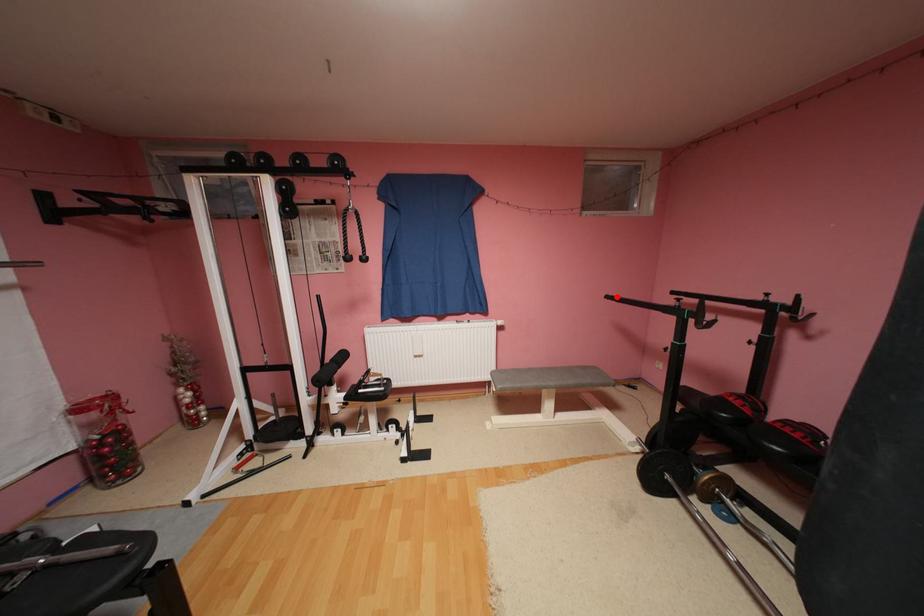
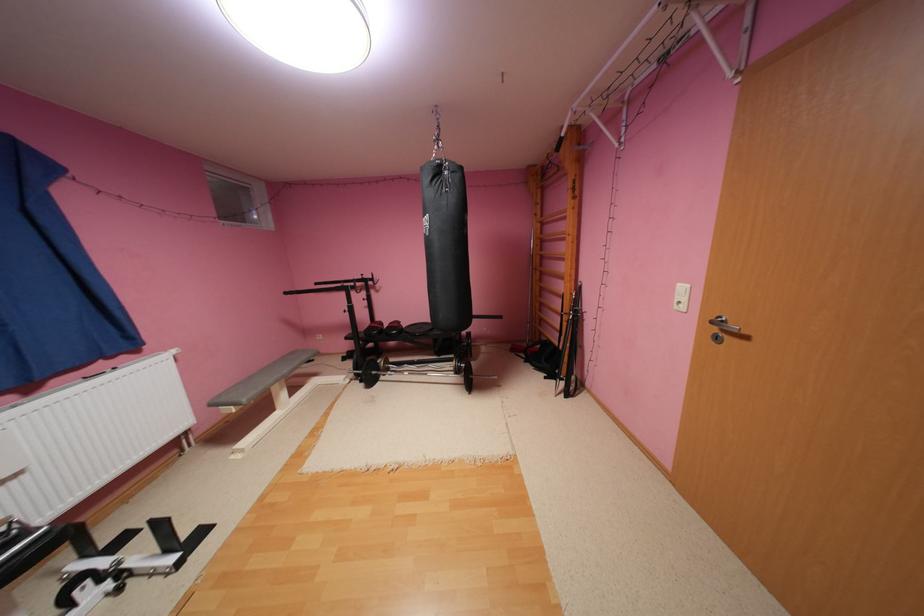
Question: I am providing you with two images of the same scene from different viewpoints. A red point is shown in image1. For the corresponding object point in image2, is it positioned nearer or farther from the camera?

Choices:
 (A) Nearer
 (B) Farther

Answer: (A)